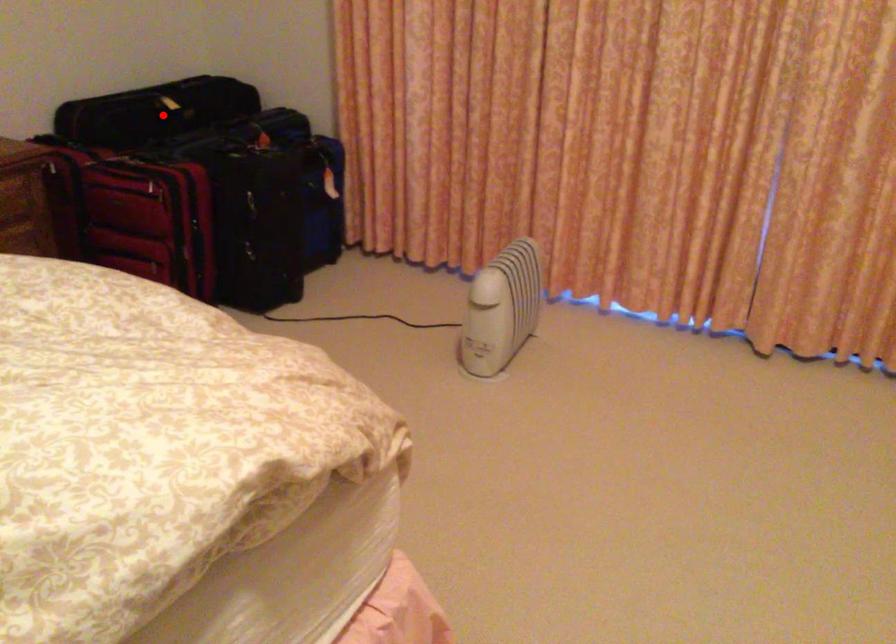
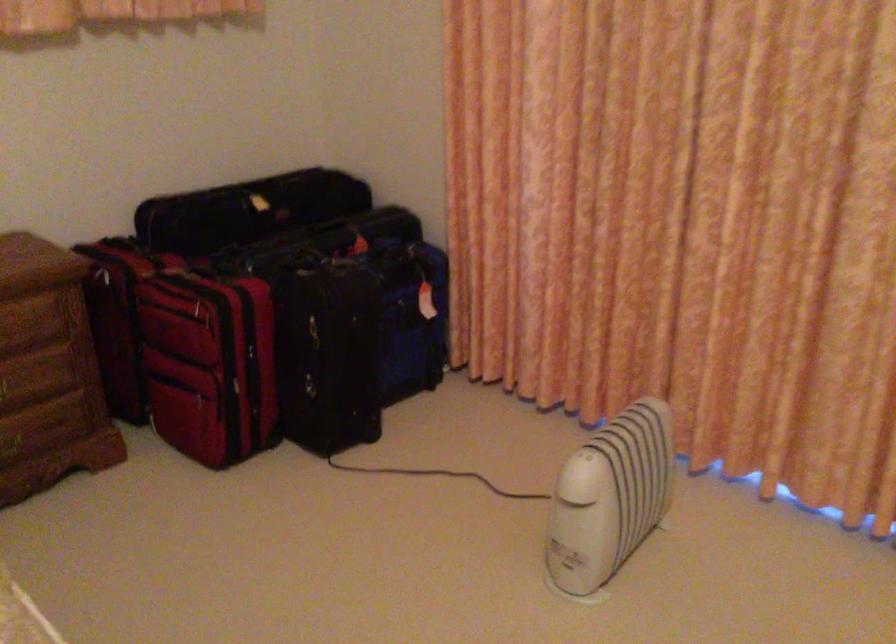
Question: I am providing you with two images of the same scene from different viewpoints. A red point is marked on the first image. At the location where the point appears in image 1, is it still visible in image 2?

Choices:
 (A) Yes
 (B) No

Answer: (A)